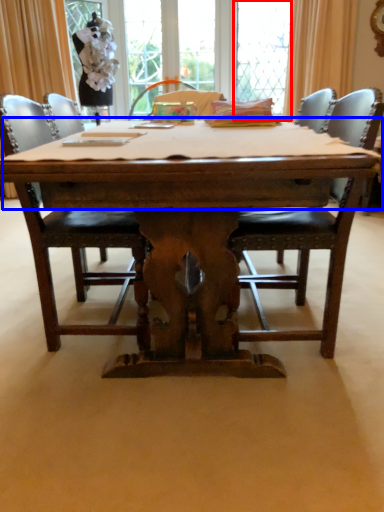
Question: Which object appears farthest to the camera in this image, window screen (highlighted by a red box) or table top (highlighted by a blue box)?

Choices:
 (A) window screen
 (B) table top

Answer: (A)